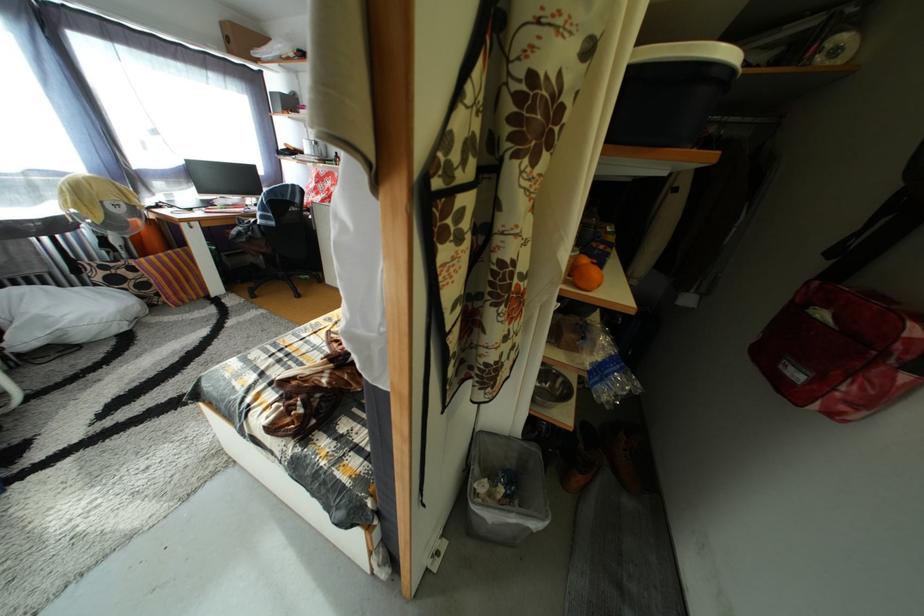
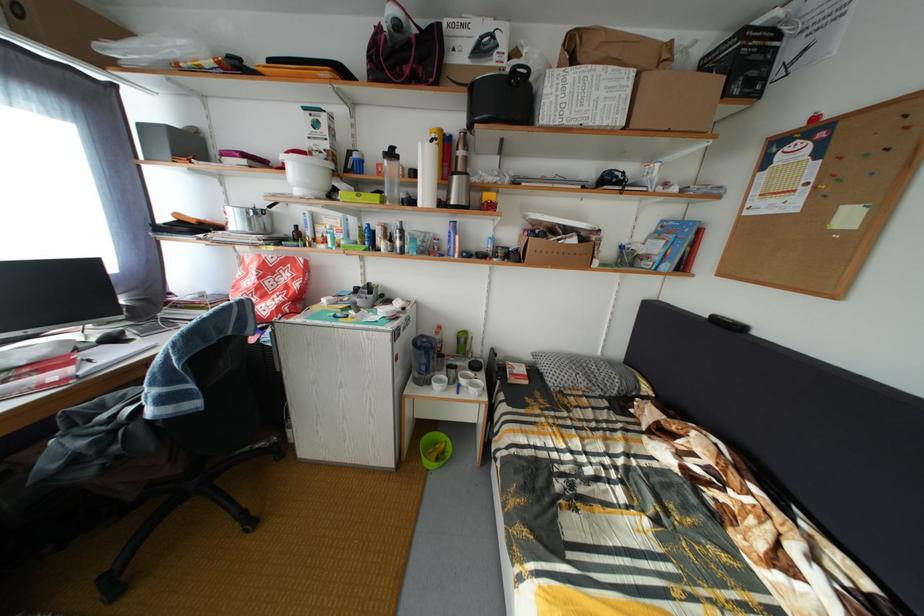
Which direction would the cameraman need to move to produce the second image?

The cameraman walked toward left, forward.